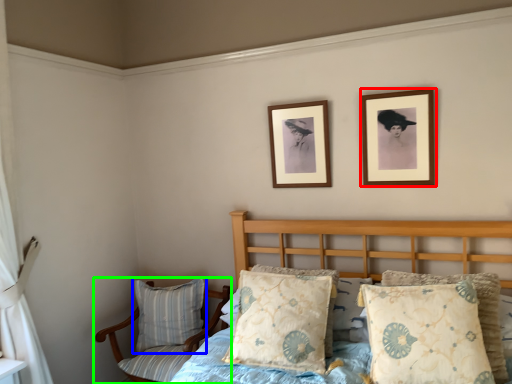
Question: Considering the real-world distances, which object is closest to picture frame (highlighted by a red box)? pillow (highlighted by a blue box) or chair (highlighted by a green box).

Choices:
 (A) pillow
 (B) chair

Answer: (B)